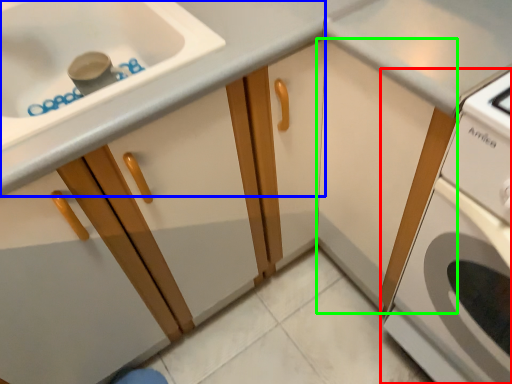
Question: Which object is positioned closest to home appliance (highlighted by a red box)? Select from cabinetry (highlighted by a blue box) and cabinetry (highlighted by a green box).

Choices:
 (A) cabinetry
 (B) cabinetry

Answer: (B)